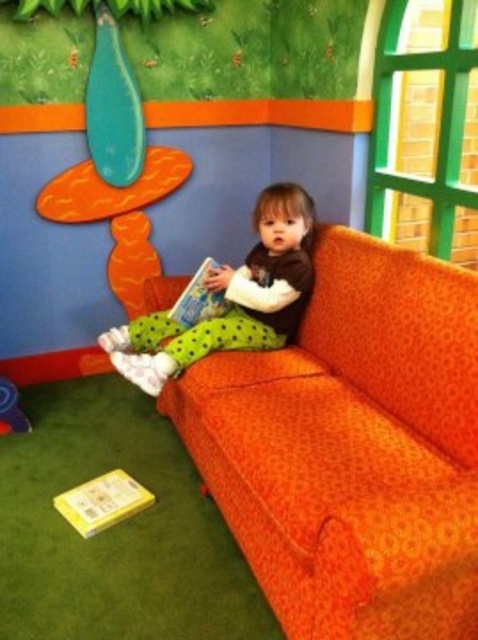
Question: Which point appears farthest from the camera in this image?

Choices:
 (A) (208, 308)
 (B) (258, 339)

Answer: (A)

Question: Does matte green pants at center appear on the right side of yellow matte book at lower left?

Choices:
 (A) no
 (B) yes

Answer: (B)

Question: Which point is farther to the camera?

Choices:
 (A) (251, 332)
 (B) (174, 317)
 (C) (85, 499)

Answer: (B)

Question: Is orange fabric couch at center behind hardcover book at center?

Choices:
 (A) yes
 (B) no

Answer: (B)

Question: Which object is closer to the camera taking this photo?

Choices:
 (A) orange fabric couch at center
 (B) matte green pants at center
 (C) hardcover book at center
 (D) yellow matte book at lower left

Answer: (A)

Question: Can you confirm if matte green pants at center is smaller than hardcover book at center?

Choices:
 (A) yes
 (B) no

Answer: (B)